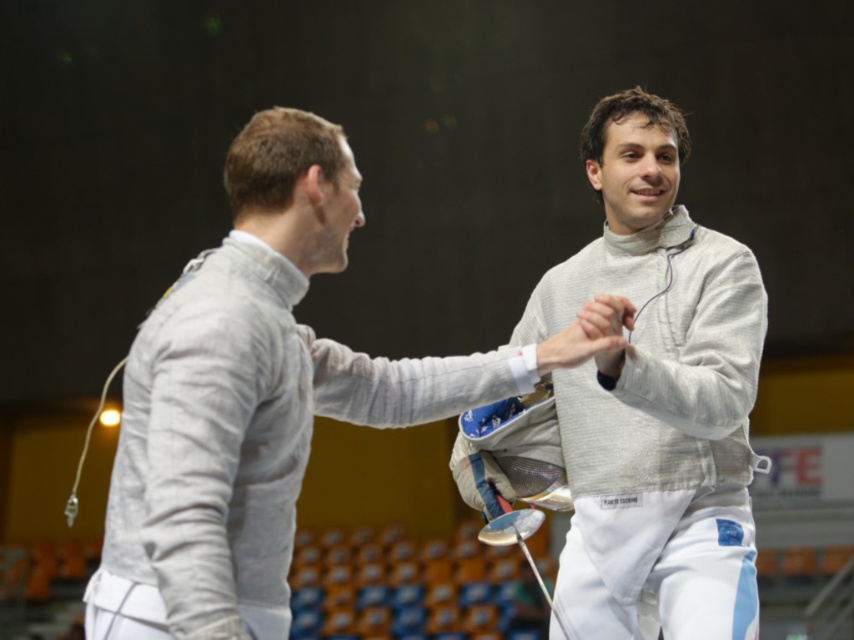
Is white fabric fencing uniform at left shorter than white matte fencing uniform at center?

Yes.

Between white fabric fencing uniform at left and white matte fencing uniform at center, which one appears on the left side from the viewer's perspective?

white fabric fencing uniform at left

I want to click on white fabric fencing uniform at left, so click(x=261, y=394).

Where is `white fabric fencing uniform at left`? The height and width of the screenshot is (640, 854). white fabric fencing uniform at left is located at coordinates (261, 394).